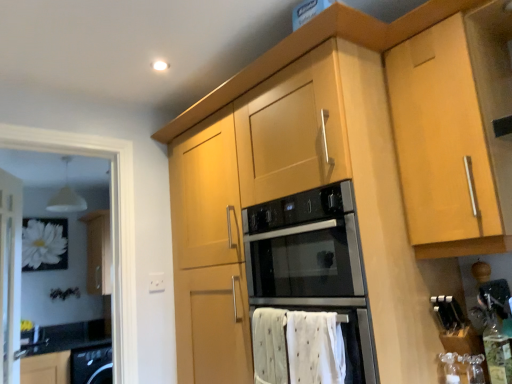
Question: Looking at their shapes, would you say white glossy sink at lower left is wider or thinner than light wood cabinet at center?

Choices:
 (A) thin
 (B) wide

Answer: (A)

Question: Is white glossy sink at lower left to the left or to the right of light wood cabinet at center in the image?

Choices:
 (A) left
 (B) right

Answer: (A)

Question: Based on their relative distances, which object is nearer to the light wood cabinet at center?

Choices:
 (A) white plastic electric outlet at lower center
 (B) white glossy screen door at left
 (C) white glossy sink at lower left
 (D) white cotton bath towel at lower center

Answer: (D)

Question: Estimate the real-world distances between objects in this image. Which object is closer to the light wood cabinet at center?

Choices:
 (A) white plastic electric outlet at lower center
 (B) white glossy sink at lower left
 (C) white cotton bath towel at lower center
 (D) white glossy screen door at left

Answer: (C)